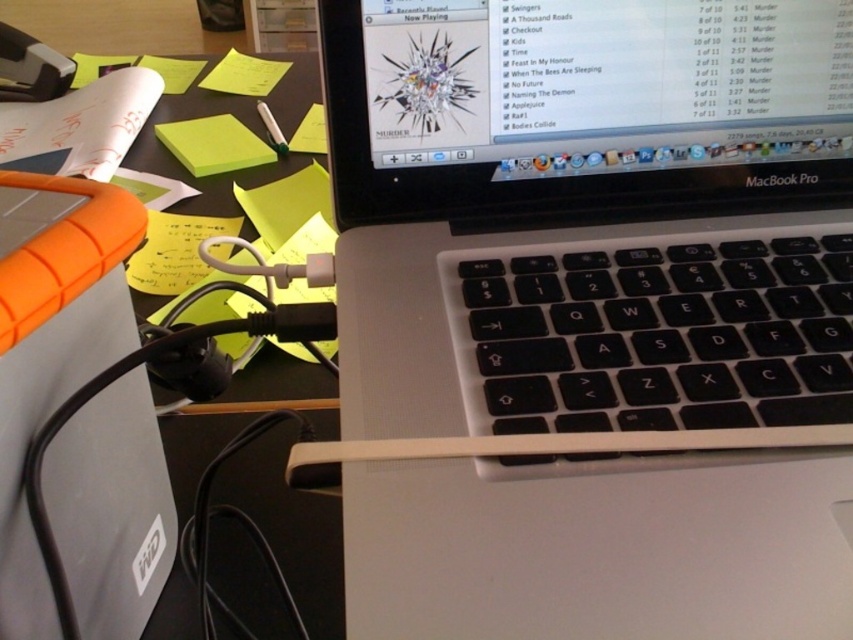
Can you confirm if yellow paper at lower left is smaller than green matte sticky note at upper left?

Indeed, yellow paper at lower left has a smaller size compared to green matte sticky note at upper left.

Can you confirm if yellow paper at lower left is taller than green matte sticky note at upper left?

No, yellow paper at lower left is not taller than green matte sticky note at upper left.

Identify the location of yellow paper at lower left. (173, 252).

Identify the location of yellow paper at lower left. This screenshot has height=640, width=853. (173, 252).

Who is lower down, silver/black keyboard at center or green matte pen at upper center?

Positioned lower is silver/black keyboard at center.

Is point (706, 276) more distant than point (259, 115)?

That is False.

Where is `silver/black keyboard at center`? The image size is (853, 640). silver/black keyboard at center is located at coordinates (590, 212).

Does point (167, 256) lie behind point (276, 150)?

No.

Who is positioned more to the right, yellow paper at lower left or green matte pen at upper center?

From the viewer's perspective, green matte pen at upper center appears more on the right side.

Is point (166, 268) positioned after point (270, 140)?

No.

The width and height of the screenshot is (853, 640). I want to click on yellow paper at lower left, so click(173, 252).